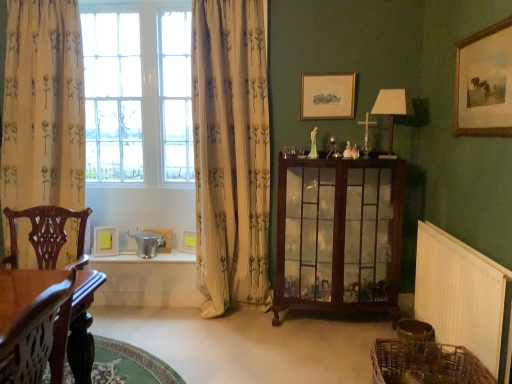
The image size is (512, 384). In order to click on free space in front of white floral fabric curtain at left, acting as the 1th curtain starting from the right in this screenshot , I will do `click(228, 331)`.